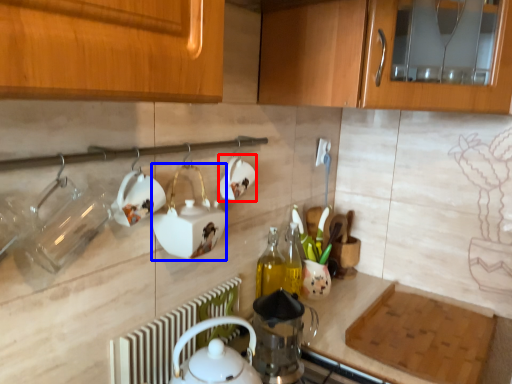
Question: Which of the following is the farthest to the observer, tableware (highlighted by a red box) or appliance (highlighted by a blue box)?

Choices:
 (A) tableware
 (B) appliance

Answer: (A)